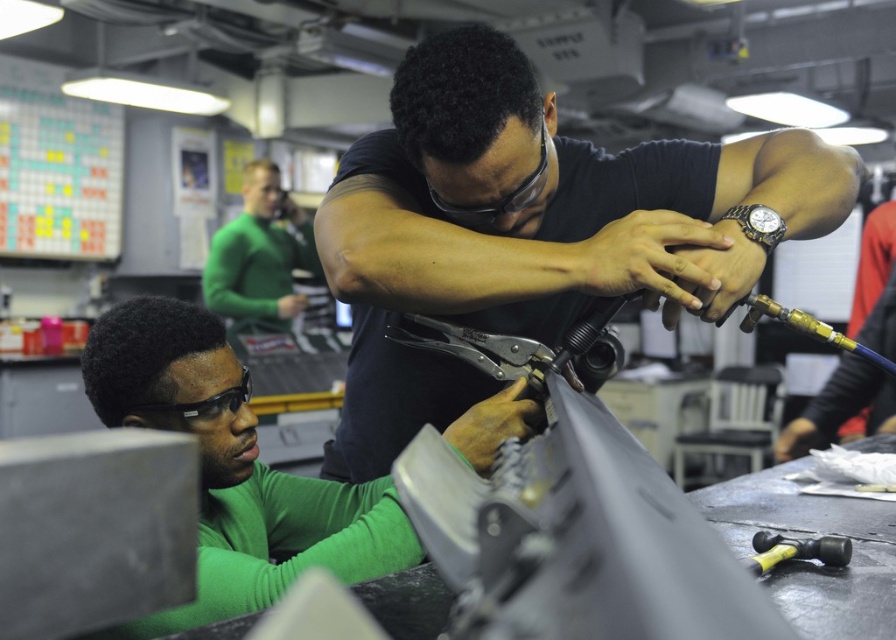
Question: Can you confirm if green matte shirt at upper center is thinner than metallic pliers at center?

Choices:
 (A) no
 (B) yes

Answer: (A)

Question: Which of these objects is positioned closest to the green matte shirt at upper center?

Choices:
 (A) yellow rubber hammer at lower right
 (B) green matte shirt at lower left
 (C) metallic pliers at center
 (D) black matte tool at center

Answer: (B)

Question: Based on their relative distances, which object is nearer to the yellow rubber hammer at lower right?

Choices:
 (A) metallic pliers at center
 (B) black matte tool at center

Answer: (A)

Question: Can you confirm if green matte shirt at lower left is positioned above metallic pliers at center?

Choices:
 (A) yes
 (B) no

Answer: (B)

Question: Which point is closer to the camera?

Choices:
 (A) (764, 541)
 (B) (489, 454)
 (C) (240, 237)

Answer: (A)

Question: In this image, where is green matte shirt at lower left located relative to metallic pliers at center?

Choices:
 (A) above
 (B) below

Answer: (B)